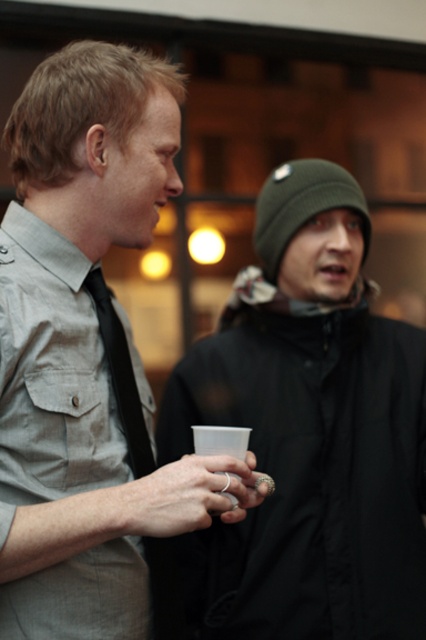
Question: Among these points, which one is farthest from the camera?

Choices:
 (A) (106, 314)
 (B) (60, 339)
 (C) (302, 516)

Answer: (C)

Question: Which object appears closest to the camera in this image?

Choices:
 (A) black matte tie at left
 (B) dark green knit hat at upper right
 (C) matte gray shirt at center

Answer: (C)

Question: Is dark green knit hat at upper right positioned before black matte tie at left?

Choices:
 (A) yes
 (B) no

Answer: (B)

Question: Does dark green knit hat at upper right appear under black matte tie at left?

Choices:
 (A) no
 (B) yes

Answer: (B)

Question: Among these points, which one is nearest to the camera?

Choices:
 (A) (382, 401)
 (B) (3, 252)

Answer: (B)

Question: Is dark green knit hat at upper right smaller than black matte tie at left?

Choices:
 (A) yes
 (B) no

Answer: (B)